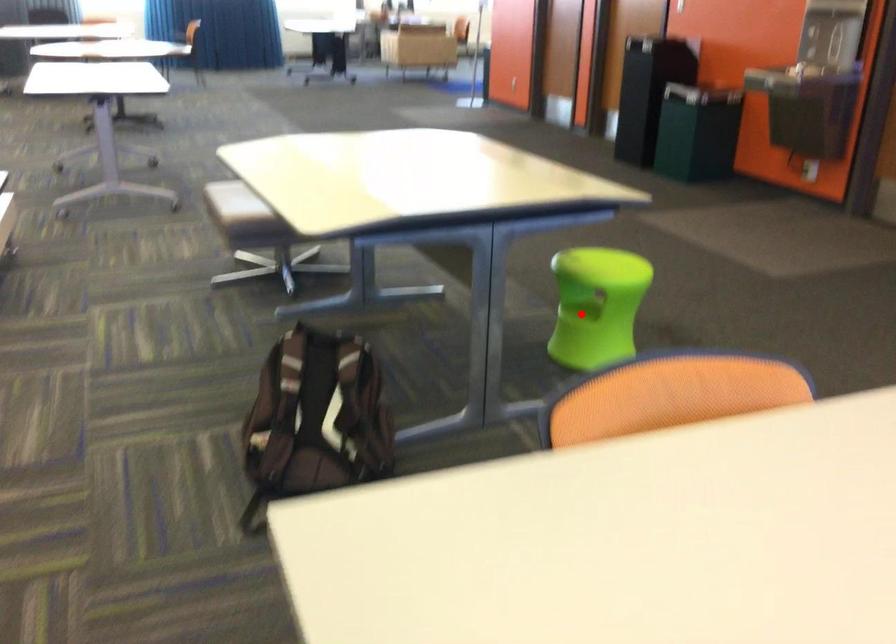
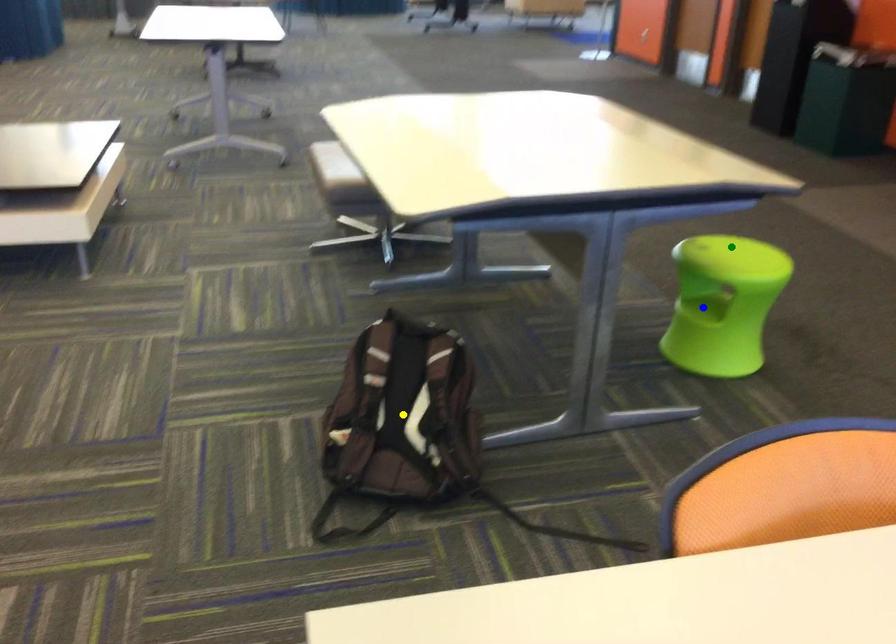
Question: I am providing you with two images of the same scene from different viewpoints. A red point is marked on the first image. You are given multiple points on the second image. In image 2, which mark is for the same physical point as the one in image 1?

Choices:
 (A) blue point
 (B) green point
 (C) yellow point

Answer: (A)